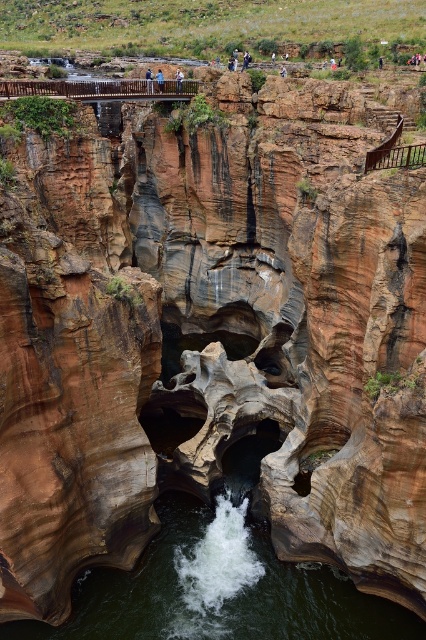
Is brown smooth rock at center shorter than blue denim jeans at upper center?

Yes.

Does brown smooth rock at center appear over blue denim jeans at upper center?

No, brown smooth rock at center is not above blue denim jeans at upper center.

Locate an element on the screen. brown smooth rock at center is located at coordinates (218, 589).

Is brown smooth rock at center smaller than light blue shirt at upper center?

Incorrect, brown smooth rock at center is not smaller in size than light blue shirt at upper center.

Is brown smooth rock at center above light blue shirt at upper center?

No.

This screenshot has height=640, width=426. What do you see at coordinates (218, 589) in the screenshot?
I see `brown smooth rock at center` at bounding box center [218, 589].

I want to click on brown smooth rock at center, so click(218, 589).

Does light blue shirt at upper center have a lesser width compared to light blue jeans at center?

Yes, light blue shirt at upper center is thinner than light blue jeans at center.

Does light blue shirt at upper center lie behind light blue jeans at center?

Yes, light blue shirt at upper center is behind light blue jeans at center.

Is point (178, 72) farther from viewer compared to point (161, 77)?

Yes, it is behind point (161, 77).

Where is `light blue shirt at upper center`? The height and width of the screenshot is (640, 426). light blue shirt at upper center is located at coordinates (178, 81).